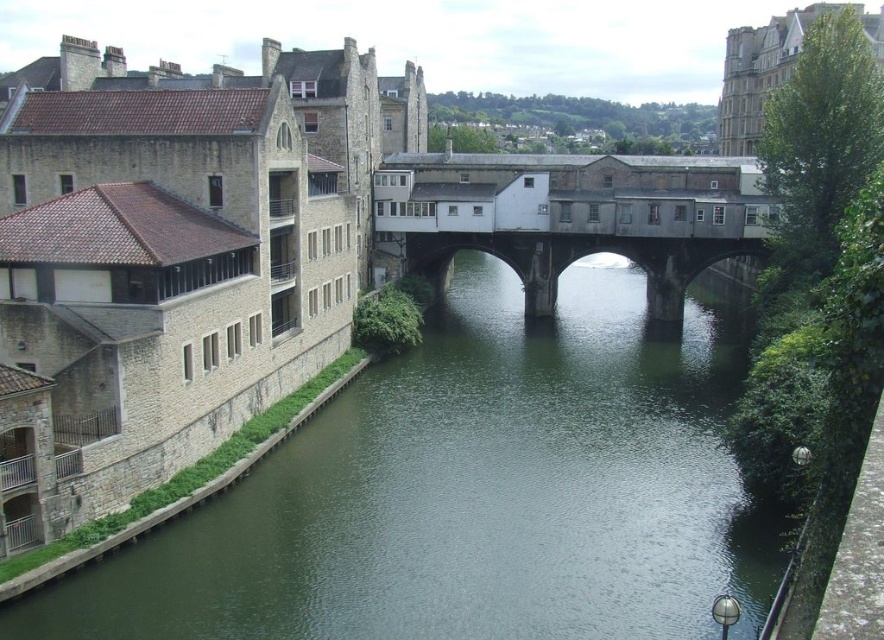
Can you confirm if green stone river at center is taller than concrete bridge at center?

Indeed, green stone river at center has a greater height compared to concrete bridge at center.

This screenshot has width=884, height=640. In order to click on green stone river at center in this screenshot , I will do `click(476, 492)`.

Find the location of a particular element. green stone river at center is located at coordinates pos(476,492).